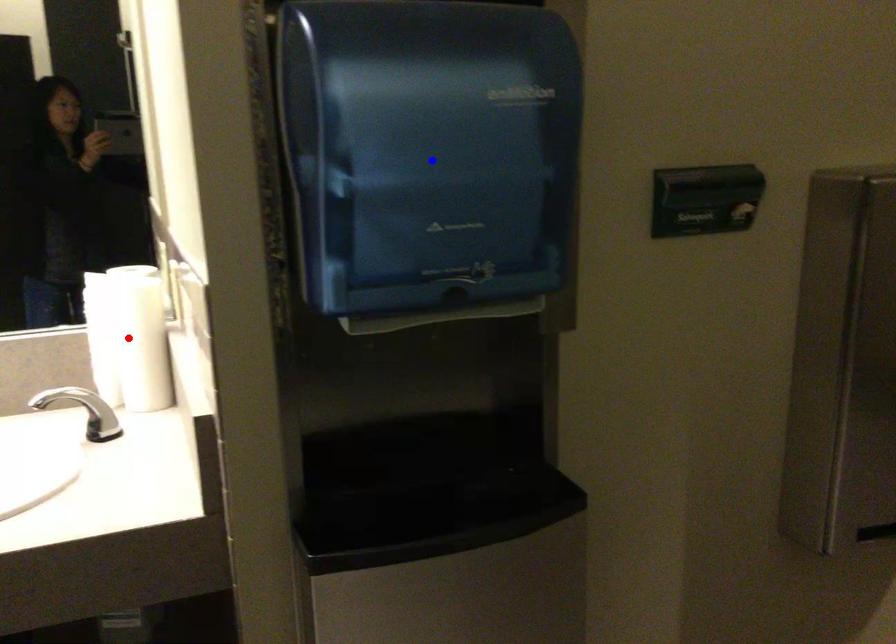
Question: Two points are marked on the image. Which point is closer to the camera?

Choices:
 (A) Blue point is closer.
 (B) Red point is closer.

Answer: (A)